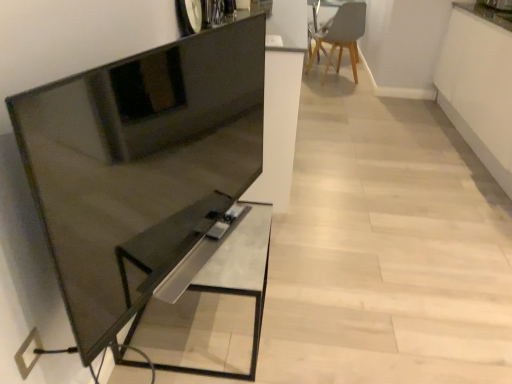
Question: Does matte gray chair at upper right have a lesser height compared to matte black tv stand at left?

Choices:
 (A) no
 (B) yes

Answer: (A)

Question: From a real-world perspective, is matte gray chair at upper right physically above matte black tv stand at left?

Choices:
 (A) yes
 (B) no

Answer: (B)

Question: From the image's perspective, is matte gray chair at upper right on top of matte black tv stand at left?

Choices:
 (A) yes
 (B) no

Answer: (A)

Question: Is matte gray chair at upper right oriented away from matte black tv stand at left?

Choices:
 (A) no
 (B) yes

Answer: (A)

Question: Considering the relative sizes of matte gray chair at upper right and matte black tv stand at left in the image provided, is matte gray chair at upper right thinner than matte black tv stand at left?

Choices:
 (A) yes
 (B) no

Answer: (B)

Question: Would you say matte gray chair at upper right contains matte black tv stand at left?

Choices:
 (A) no
 (B) yes

Answer: (A)

Question: From the image's perspective, is metallic silver table at center under matte gray chair at upper right?

Choices:
 (A) no
 (B) yes

Answer: (B)

Question: Does metallic silver table at center have a smaller size compared to matte gray chair at upper right?

Choices:
 (A) yes
 (B) no

Answer: (A)

Question: Considering the relative sizes of metallic silver table at center and matte gray chair at upper right in the image provided, is metallic silver table at center thinner than matte gray chair at upper right?

Choices:
 (A) no
 (B) yes

Answer: (B)

Question: Would you say metallic silver table at center contains matte gray chair at upper right?

Choices:
 (A) yes
 (B) no

Answer: (B)

Question: From a real-world perspective, is metallic silver table at center located higher than matte gray chair at upper right?

Choices:
 (A) no
 (B) yes

Answer: (A)

Question: Considering the relative positions of metallic silver table at center and matte gray chair at upper right in the image provided, is metallic silver table at center in front of matte gray chair at upper right?

Choices:
 (A) no
 (B) yes

Answer: (B)

Question: Considering the relative sizes of matte gray chair at upper right and metallic silver table at center in the image provided, is matte gray chair at upper right thinner than metallic silver table at center?

Choices:
 (A) no
 (B) yes

Answer: (A)